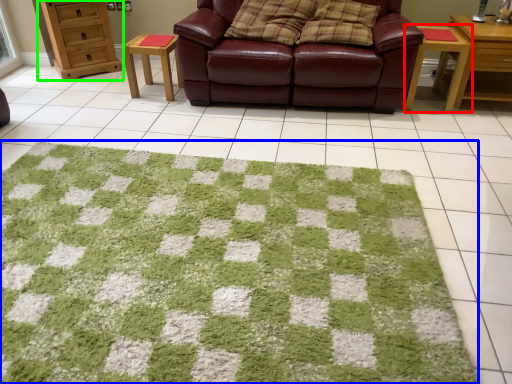
Question: Based on their relative distances, which object is nearer to table (highlighted by a red box)? Choose from mat (highlighted by a blue box) and chest of drawers (highlighted by a green box).

Choices:
 (A) mat
 (B) chest of drawers

Answer: (A)